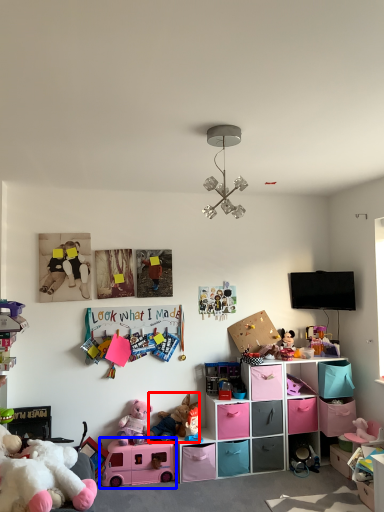
Question: Which object appears farthest to the camera in this image, toy (highlighted by a red box) or toy (highlighted by a blue box)?

Choices:
 (A) toy
 (B) toy

Answer: (A)